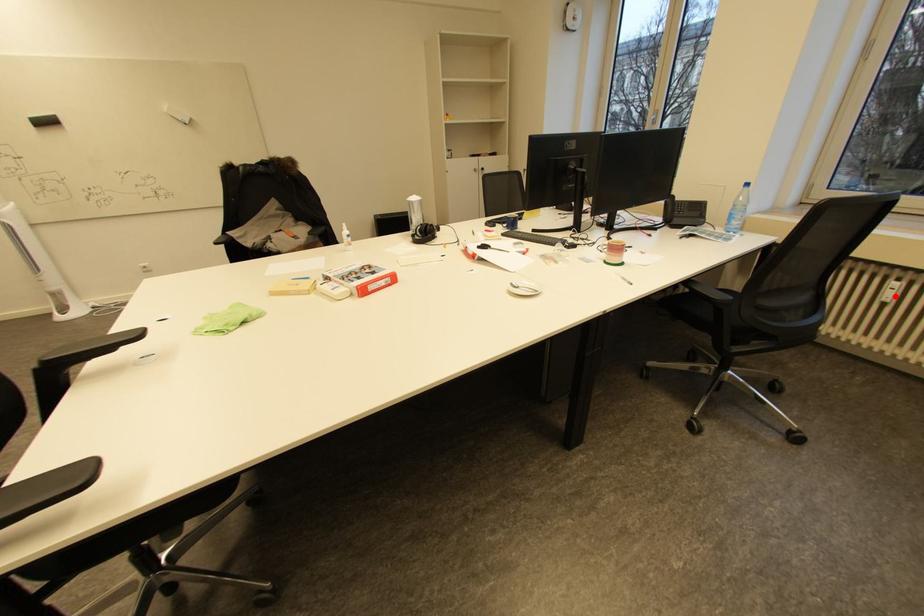
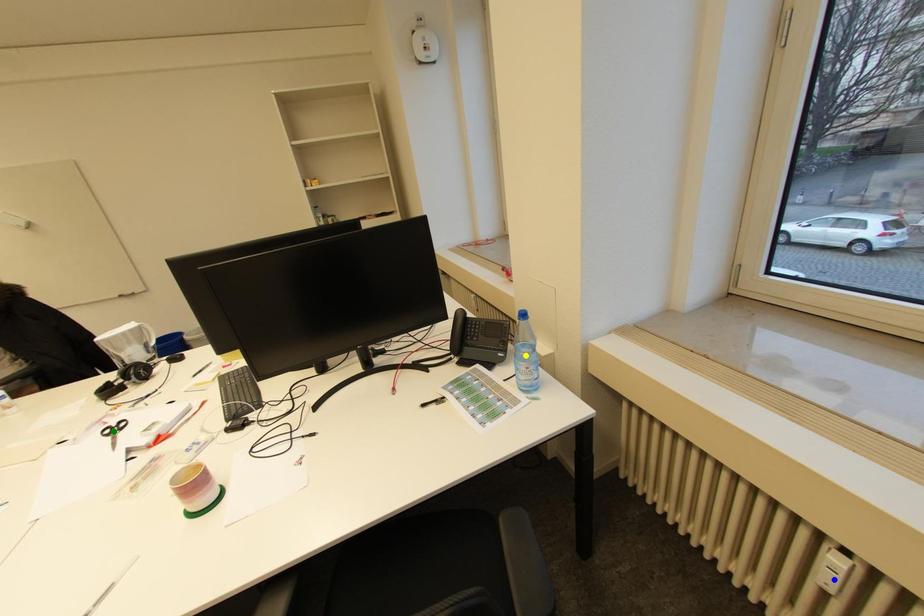
Question: I am providing you with two images of the same scene from different viewpoints. A red point is marked on the first image. You are given multiple points on the second image. In image 2, which mark is for the same physical point as the one in image 1?

Choices:
 (A) green point
 (B) yellow point
 (C) blue point

Answer: (C)